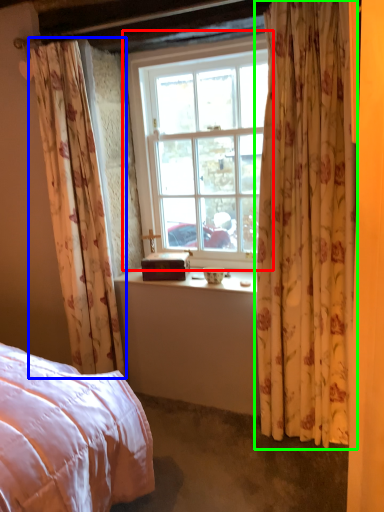
Question: Which is farther away from window (highlighted by a red box)? curtain (highlighted by a blue box) or curtain (highlighted by a green box)?

Choices:
 (A) curtain
 (B) curtain

Answer: (B)